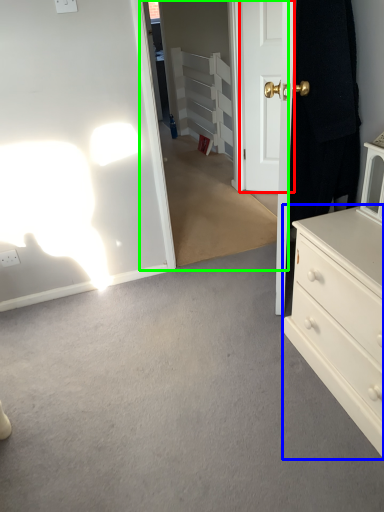
Question: Which object is positioned closest to door (highlighted by a red box)? Select from chest of drawers (highlighted by a blue box) and glass door (highlighted by a green box).

Choices:
 (A) chest of drawers
 (B) glass door

Answer: (B)